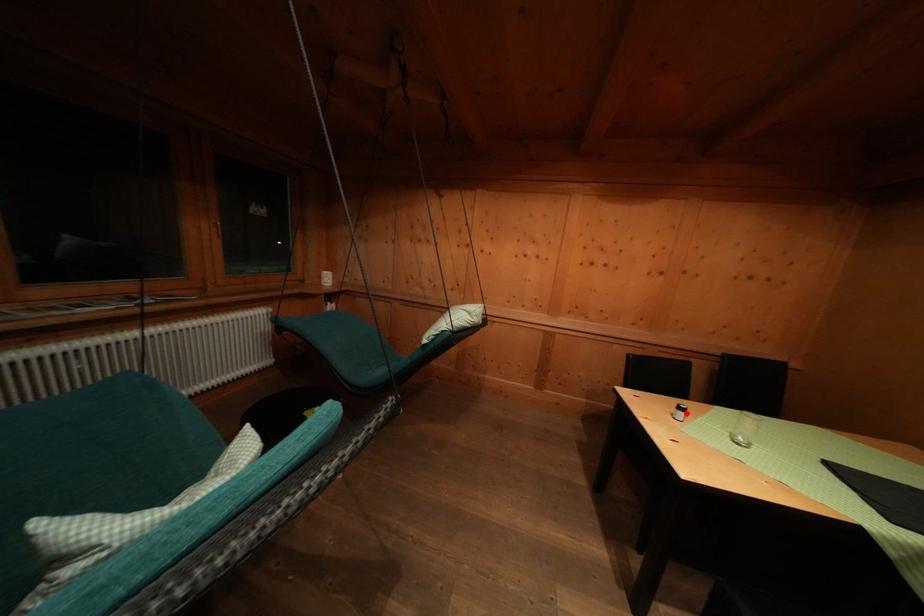
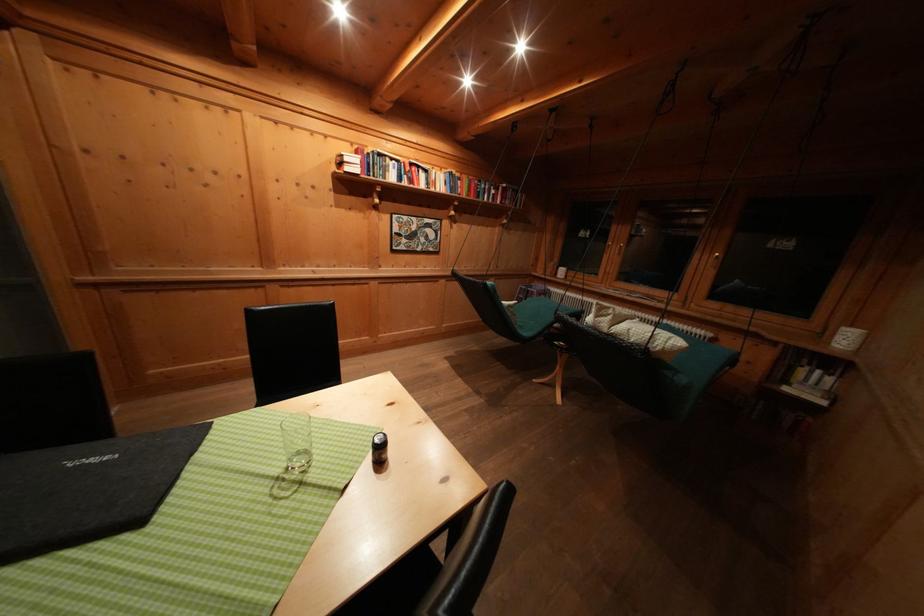
The point at the highlighted location is marked in the first image. Where is the corresponding point in the second image?

(388, 444)